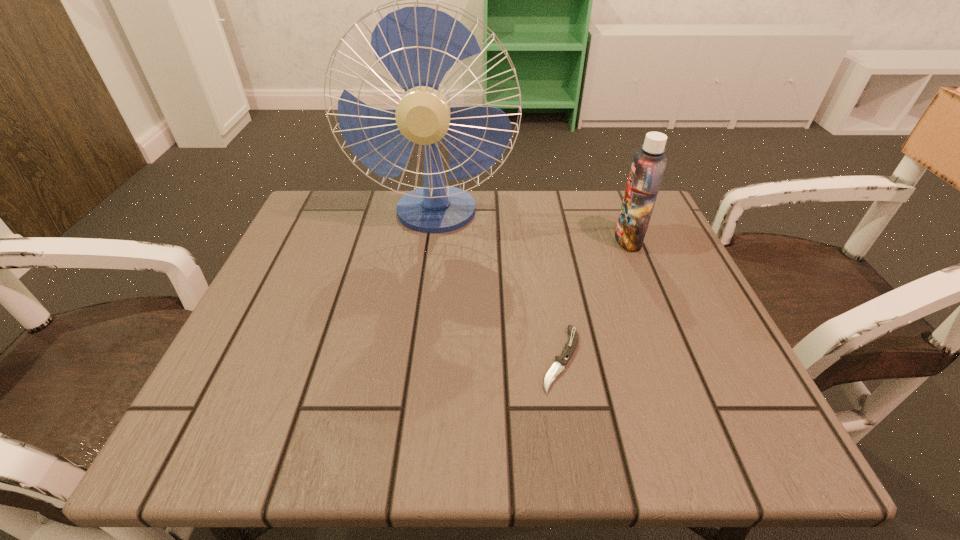
Locate an element on the screen. vacant area at the right edge is located at coordinates (739, 383).

I want to click on blank space at the far left corner of the desktop, so click(349, 197).

You are a GUI agent. You are given a task and a screenshot of the screen. Output one action in this format:
    pyautogui.click(x=<x>, y=<y>)
    Task: Click on the vacant space at the far right corner of the desktop
    This screenshot has width=960, height=540.
    Given the screenshot: What is the action you would take?
    pyautogui.click(x=655, y=232)

At what (x,y) coordinates should I click in order to perform the action: click on blank region between the pocketknife and the leftmost object. Please return your answer as a coordinate pair (x, y). The width and height of the screenshot is (960, 540). Looking at the image, I should click on (498, 286).

Where is `vacant space that is in between the shampoo and the tallest object`? The image size is (960, 540). vacant space that is in between the shampoo and the tallest object is located at coordinates (532, 227).

The image size is (960, 540). What are the coordinates of `free spot between the second object from left to right and the second tallest object` in the screenshot? It's located at (595, 299).

Locate an element on the screen. Image resolution: width=960 pixels, height=540 pixels. vacant point located between the pocketknife and the fan is located at coordinates (498, 286).

Identify the location of unoccupied position between the nearest object and the fan. This screenshot has width=960, height=540. (498, 286).

The width and height of the screenshot is (960, 540). I want to click on vacant area that lies between the leftmost object and the second shortest object, so click(532, 227).

In order to click on free space that is in between the rightmost object and the fan in this screenshot , I will do `click(532, 227)`.